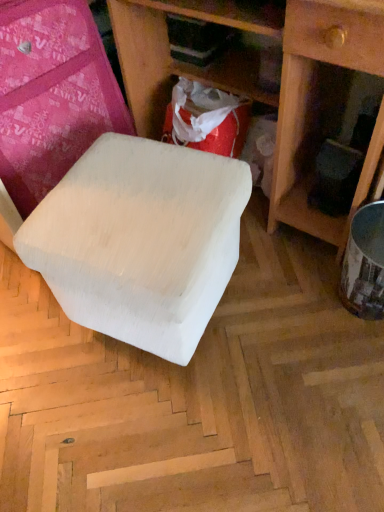
Question: Is white matte stool at center taller than matte white stool at center?

Choices:
 (A) no
 (B) yes

Answer: (A)

Question: Is white matte stool at center with matte white stool at center?

Choices:
 (A) no
 (B) yes

Answer: (A)

Question: Is white matte stool at center surrounding matte white stool at center?

Choices:
 (A) no
 (B) yes

Answer: (A)

Question: Is white matte stool at center facing towards matte white stool at center?

Choices:
 (A) yes
 (B) no

Answer: (B)

Question: Is white matte stool at center positioned with its back to matte white stool at center?

Choices:
 (A) no
 (B) yes

Answer: (B)

Question: Is white matte stool at center shorter than matte white stool at center?

Choices:
 (A) no
 (B) yes

Answer: (B)

Question: Considering the relative sizes of matte white stool at center and white matte stool at center in the image provided, is matte white stool at center wider than white matte stool at center?

Choices:
 (A) no
 (B) yes

Answer: (B)

Question: Considering the relative positions of matte white stool at center and white matte stool at center in the image provided, is matte white stool at center to the left of white matte stool at center from the viewer's perspective?

Choices:
 (A) no
 (B) yes

Answer: (A)

Question: Is matte white stool at center placed right next to white matte stool at center?

Choices:
 (A) no
 (B) yes

Answer: (A)

Question: Can you confirm if matte white stool at center is taller than white matte stool at center?

Choices:
 (A) yes
 (B) no

Answer: (A)

Question: Does matte white stool at center have a lesser height compared to white matte stool at center?

Choices:
 (A) yes
 (B) no

Answer: (B)

Question: From a real-world perspective, is matte white stool at center on white matte stool at center?

Choices:
 (A) no
 (B) yes

Answer: (B)

Question: Looking at their shapes, would you say white matte stool at center is wider or thinner than matte white stool at center?

Choices:
 (A) wide
 (B) thin

Answer: (B)